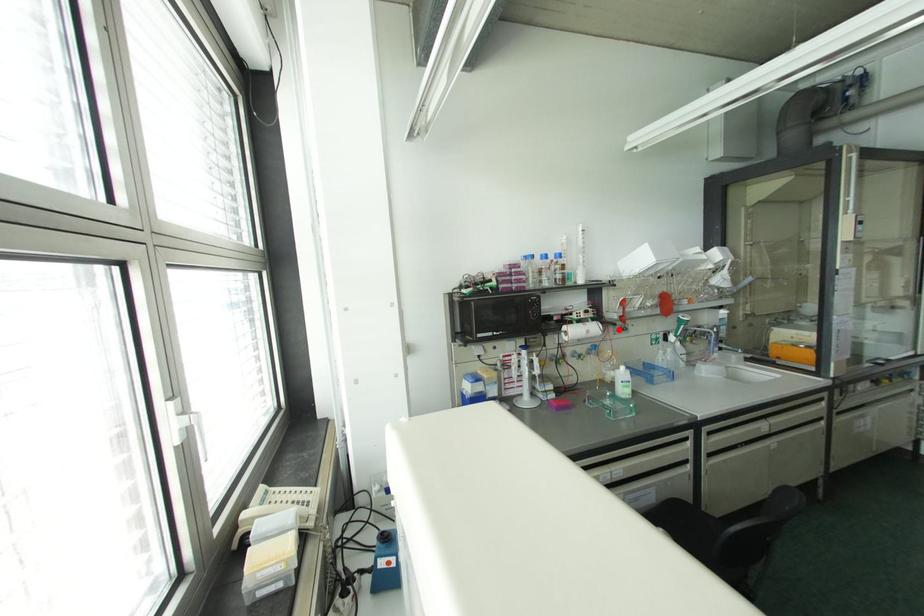
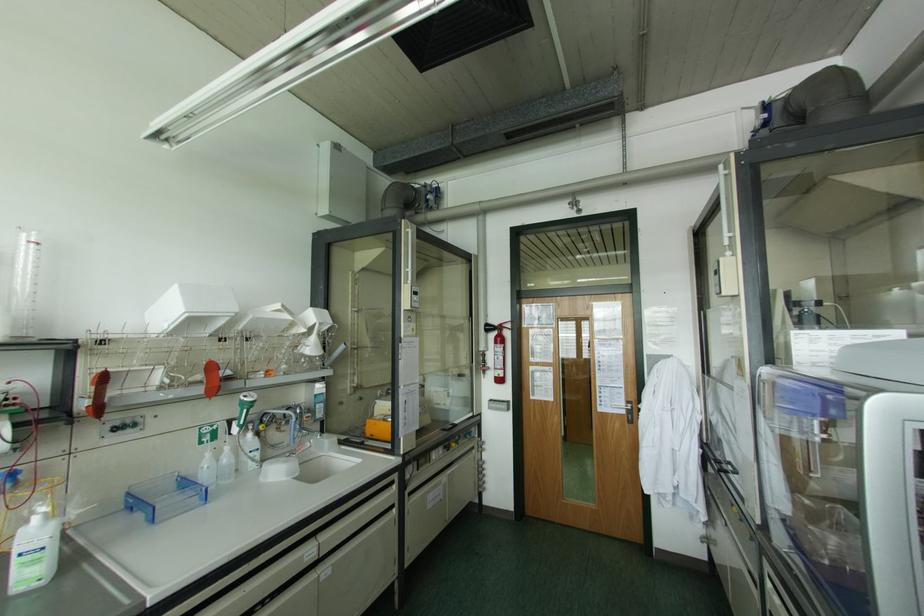
Find the pixel in the second image that matches the highlighted location in the first image.

(115, 428)